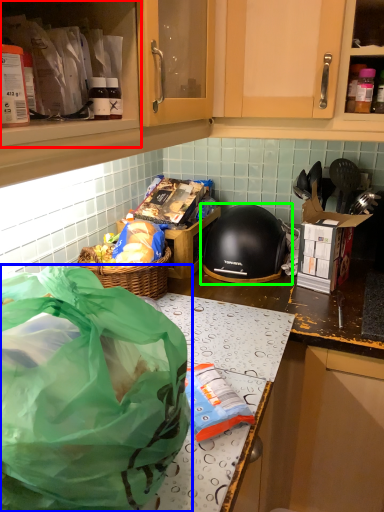
Question: Estimate the real-world distances between objects in this image. Which object is farther from cabinetry (highlighted by a red box), plastic bag (highlighted by a blue box) or helmet (highlighted by a green box)?

Choices:
 (A) plastic bag
 (B) helmet

Answer: (B)